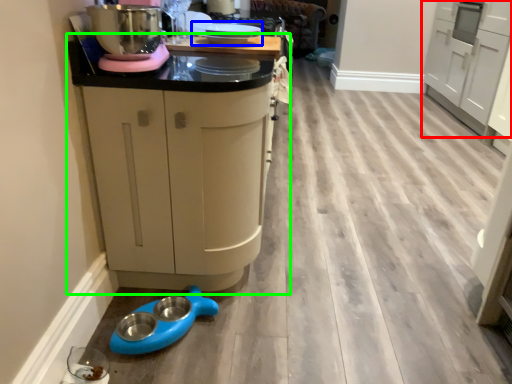
Question: Based on their relative distances, which object is nearer to cabinetry (highlighted by a red box)? Choose from appliance (highlighted by a blue box) and cabinetry (highlighted by a green box).

Choices:
 (A) appliance
 (B) cabinetry

Answer: (A)